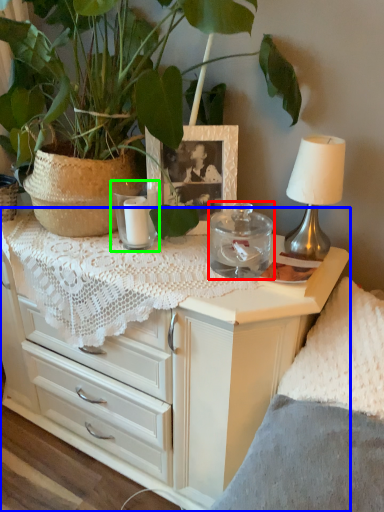
Question: Which object is the farthest from candle holder (highlighted by a red box)? Choose among these: chest of drawers (highlighted by a blue box) or candle holder (highlighted by a green box).

Choices:
 (A) chest of drawers
 (B) candle holder

Answer: (A)